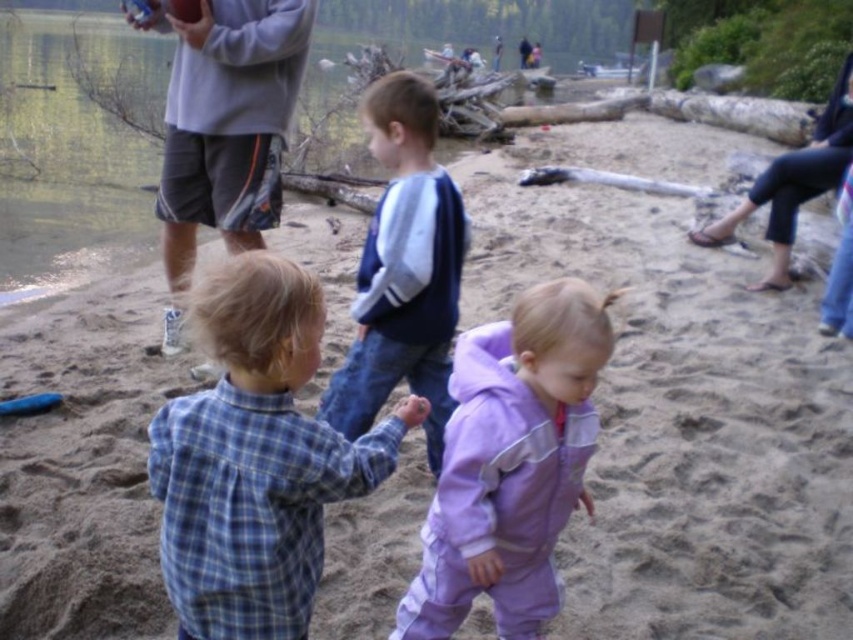
Question: Considering the relative positions of blue plaid shirt at center and matte gray water at upper left in the image provided, where is blue plaid shirt at center located with respect to matte gray water at upper left?

Choices:
 (A) right
 (B) left

Answer: (A)

Question: Which point is closer to the camera taking this photo?

Choices:
 (A) (126, 157)
 (B) (776, 241)
 (C) (485, 362)

Answer: (C)

Question: Where is blue plaid shirt at center located in relation to blue fleece jacket at center in the image?

Choices:
 (A) above
 (B) below

Answer: (B)

Question: Which of the following is the closest to the observer?

Choices:
 (A) (444, 264)
 (B) (776, 214)

Answer: (A)

Question: Which is nearer to the purple fleece suit at center?

Choices:
 (A) purple fleece jacket at upper right
 (B) blue fleece jacket at center
 (C) gray fabric shorts at upper left
 (D) blue plaid shirt at center

Answer: (D)

Question: Is blue plaid shirt at center wider than gray fabric shorts at upper left?

Choices:
 (A) no
 (B) yes

Answer: (A)